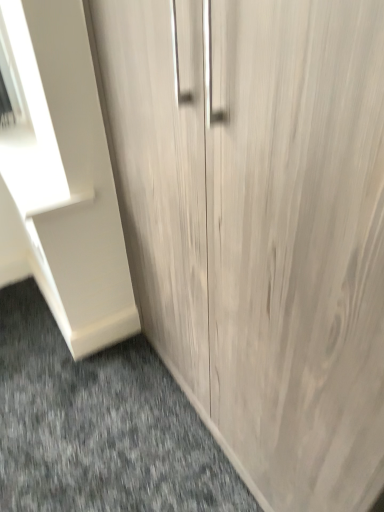
The height and width of the screenshot is (512, 384). What are the coordinates of `light wood cabinet at lower right` in the screenshot? It's located at (99, 426).

This screenshot has width=384, height=512. Describe the element at coordinates (99, 426) in the screenshot. I see `light wood cabinet at lower right` at that location.

The image size is (384, 512). Find the location of `light wood cabinet at lower right`. light wood cabinet at lower right is located at coordinates (99, 426).